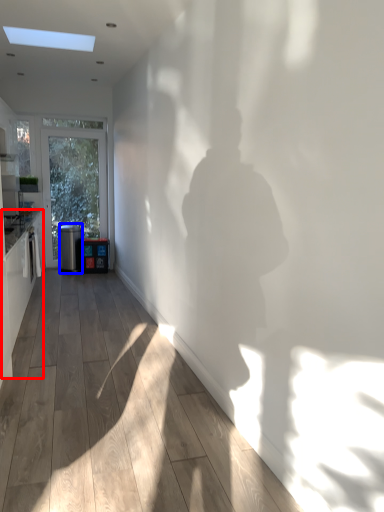
Question: Which object appears farthest to the camera in this image, cabinetry (highlighted by a red box) or appliance (highlighted by a blue box)?

Choices:
 (A) cabinetry
 (B) appliance

Answer: (B)